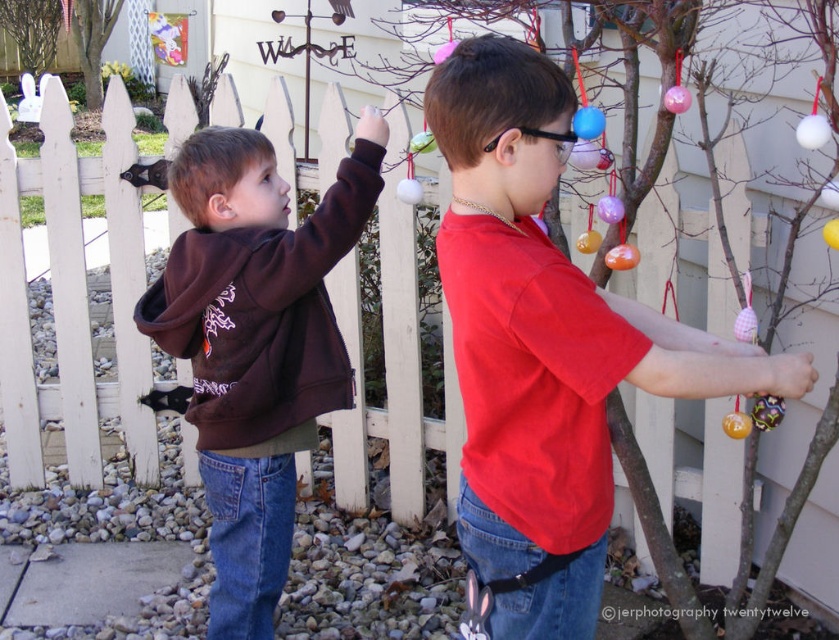
You are organizing a photo shoot and need to ensure that all subjects are visible in the frame. Given that the matte red shirt at center and the matte brown hoodie at left are both in the shot, which one might require adjustment to ensure it doesn not block the other?

The matte brown hoodie at left occupies more space than the matte red shirt at center, so it might require adjustment to ensure it does not block the other.

You are a photographer setting up for a group photo of the two boys. You need to position them so that the matte red shirt at center and the matte brown hoodie at left are both visible in the frame. Considering their clothing widths, which boy should you place closer to the camera to ensure their shirts are equally visible?

The matte red shirt at center is wider than the matte brown hoodie at left. To make their shirts equally visible in the photo, position the matte brown hoodie at left closer to the camera since its narrower width requires less space in the frame compared to the wider matte red shirt at center.